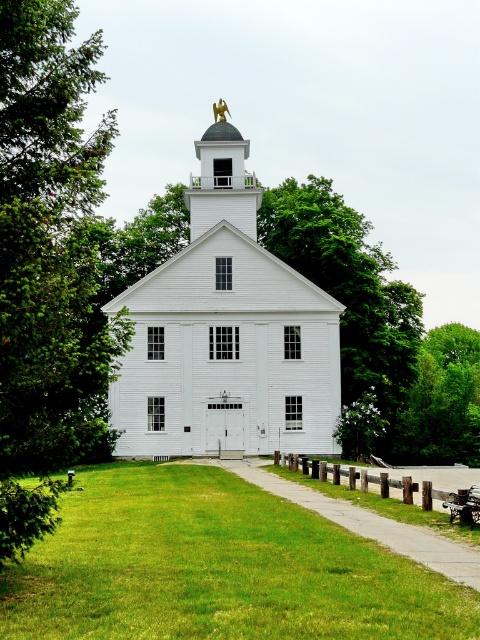
Question: Can you confirm if green grass at center is positioned to the left of brown wooden park bench at lower right?

Choices:
 (A) yes
 (B) no

Answer: (A)

Question: Based on their relative distances, which object is nearer to the green leafy tree at center?

Choices:
 (A) green leafy tree at left
 (B) gravel path at center

Answer: (A)

Question: Considering the relative positions of green leafy tree at center and gravel path at center in the image provided, where is green leafy tree at center located with respect to gravel path at center?

Choices:
 (A) above
 (B) below

Answer: (A)

Question: Which point appears farthest from the camera in this image?

Choices:
 (A) (471, 500)
 (B) (6, 204)
 (C) (287, 241)
 (D) (333, 307)

Answer: (C)

Question: Which object is closer to the camera taking this photo?

Choices:
 (A) green leafy tree at left
 (B) green leafy tree at center
 (C) white matte church at center

Answer: (A)

Question: Is green leafy tree at center in front of gold plated eagle at upper center?

Choices:
 (A) no
 (B) yes

Answer: (B)